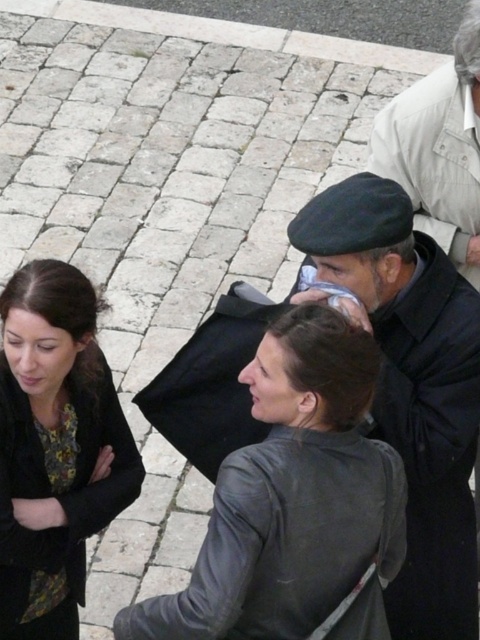
Question: Can you confirm if matte gray jacket at center is positioned to the right of dark gray woolen coat at center?

Choices:
 (A) yes
 (B) no

Answer: (B)

Question: Which of the following is the closest to the observer?

Choices:
 (A) (454, 348)
 (B) (139, 461)
 (C) (286, 422)

Answer: (C)

Question: Which object appears closest to the camera in this image?

Choices:
 (A) matte gray jacket at center
 (B) matte black jacket at left
 (C) dark gray wool beret at center
 (D) dark gray woolen coat at center

Answer: (A)

Question: Can you confirm if matte gray jacket at center is positioned below matte black jacket at left?

Choices:
 (A) no
 (B) yes

Answer: (A)

Question: Does matte gray jacket at center lie behind matte black jacket at left?

Choices:
 (A) no
 (B) yes

Answer: (A)

Question: Which of the following is the farthest from the observer?

Choices:
 (A) matte black jacket at left
 (B) matte gray jacket at center
 (C) dark gray woolen coat at center

Answer: (C)